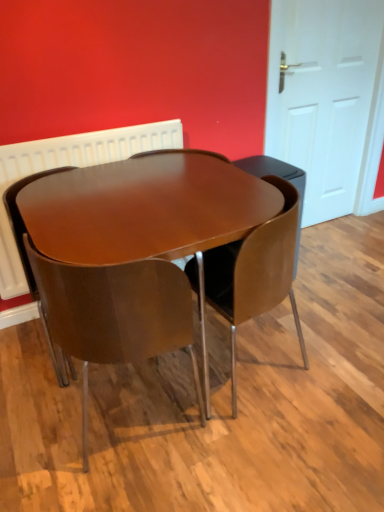
Image resolution: width=384 pixels, height=512 pixels. What are the coordinates of `free space to the left of glossy wood chair at center, the first chair in the left-to-right sequence` in the screenshot? It's located at (24, 350).